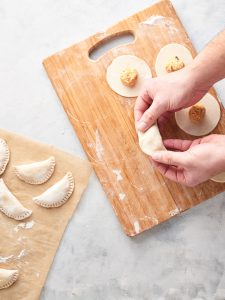
The image size is (225, 300). Identify the location of cutting board. (134, 189).